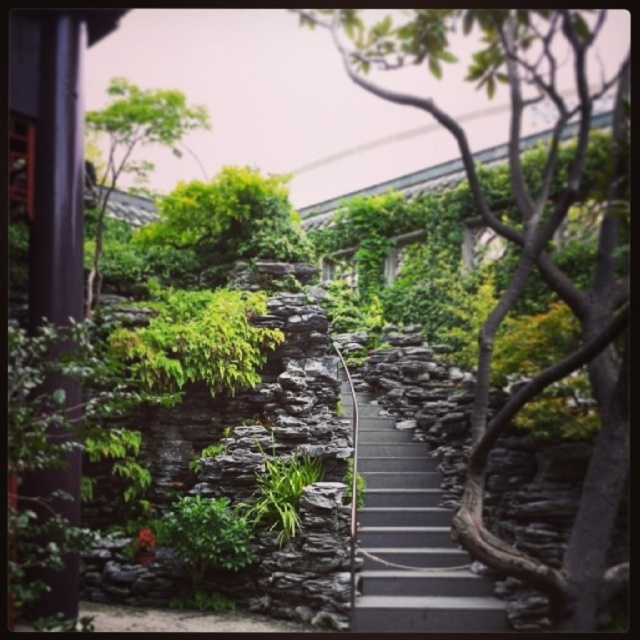
Question: Estimate the real-world distances between objects in this image. Which object is closer to the green leafy tree at center?

Choices:
 (A) green leafy tree at upper left
 (B) dark gray stone stairs at center

Answer: (B)

Question: Which point is farther to the camera?

Choices:
 (A) (392, 573)
 (B) (548, 381)

Answer: (A)

Question: Can you confirm if green leafy tree at center is positioned above green leafy tree at upper left?

Choices:
 (A) yes
 (B) no

Answer: (A)

Question: Is green leafy tree at center smaller than dark gray stone stairs at center?

Choices:
 (A) no
 (B) yes

Answer: (A)

Question: Observing the image, what is the correct spatial positioning of dark gray stone stairs at center in reference to green leafy tree at upper left?

Choices:
 (A) right
 (B) left

Answer: (A)

Question: Which object is closer to the camera taking this photo?

Choices:
 (A) dark gray stone stairs at center
 (B) green leafy tree at center
 (C) green leafy tree at upper left

Answer: (B)